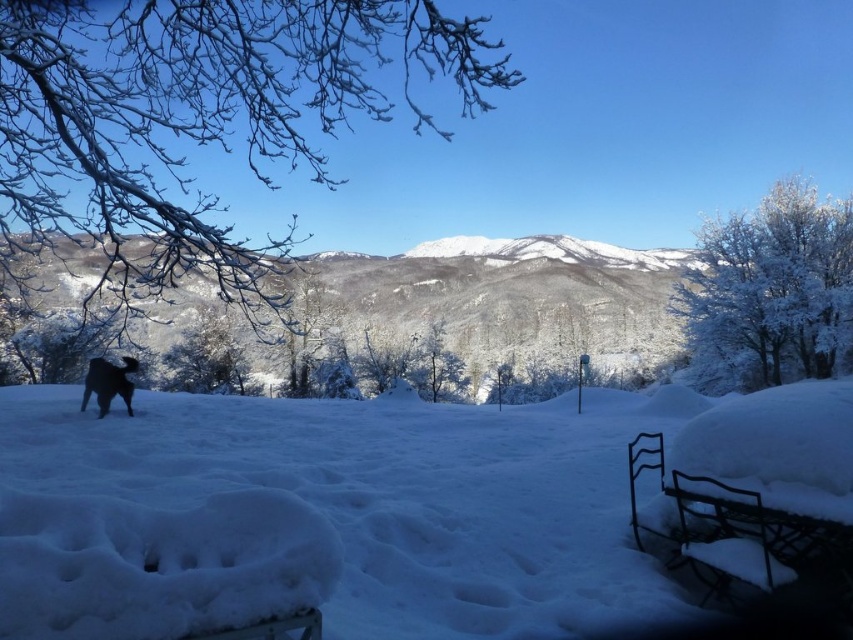
You are standing in the winter landscape and see the white fluffy snow at lower left and the black fur dog at lower left. From your perspective, which object is positioned more to the right?

The white fluffy snow at lower left is to the right of the black fur dog at lower left, so the white fluffy snow at lower left is positioned more to the right.

You are standing at the center of the winter landscape and want to reach the white fluffy snow at lower left. According to the coordinates provided, in which direction should you move to get there?

The white fluffy snow at lower left is located at coordinates point (376,502), so you should move towards the lower left direction to reach it.